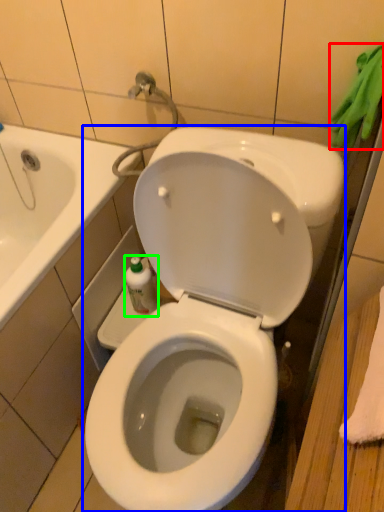
Question: Estimate the real-world distances between objects in this image. Which object is farther from bath towel (highlighted by a red box), toilet (highlighted by a blue box) or bottle (highlighted by a green box)?

Choices:
 (A) toilet
 (B) bottle

Answer: (B)